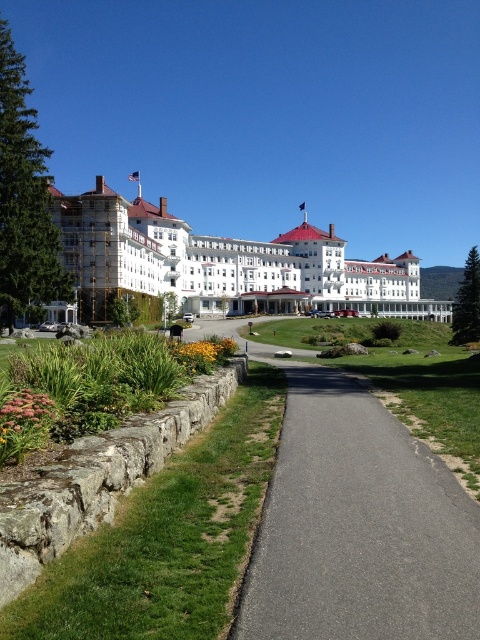
Who is more forward, [284,300] or [1,429]?

Positioned in front is point [1,429].

Can you confirm if white/smooth hotel at center is positioned to the right of pink matte flower at lower left?

Yes, white/smooth hotel at center is to the right of pink matte flower at lower left.

This screenshot has width=480, height=640. What are the coordinates of `white/smooth hotel at center` in the screenshot? It's located at (228, 262).

Is asphalt path at center wider than yellow matte flower at lower center?

Yes, asphalt path at center is wider than yellow matte flower at lower center.

Does asphalt path at center appear on the right side of yellow matte flower at lower center?

Correct, you'll find asphalt path at center to the right of yellow matte flower at lower center.

What do you see at coordinates (357, 524) in the screenshot? I see `asphalt path at center` at bounding box center [357, 524].

Locate an element on the screen. The width and height of the screenshot is (480, 640). asphalt path at center is located at coordinates (357, 524).

Can you confirm if asphalt path at center is smaller than white/smooth hotel at center?

Correct, asphalt path at center occupies less space than white/smooth hotel at center.

Does asphalt path at center appear under white/smooth hotel at center?

Yes, asphalt path at center is below white/smooth hotel at center.

You are a GUI agent. You are given a task and a screenshot of the screen. Output one action in this format:
    pyautogui.click(x=<x>, y=<y>)
    Task: Click on the asphalt path at center
    Image resolution: width=480 pixels, height=640 pixels.
    Given the screenshot: What is the action you would take?
    pyautogui.click(x=357, y=524)